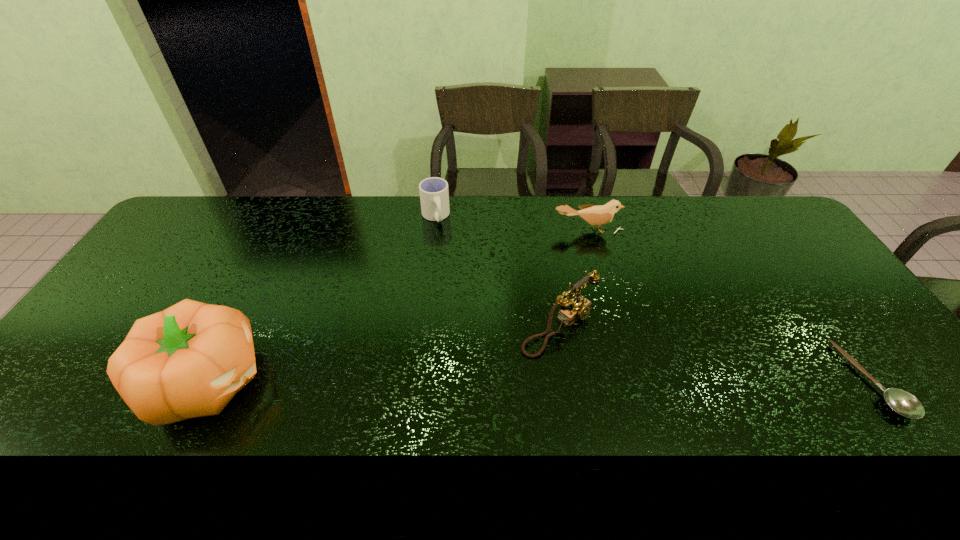
Image resolution: width=960 pixels, height=540 pixels. What are the coordinates of `blank area located with the handle on the side of the fourth object from right to left` in the screenshot? It's located at click(456, 308).

Find the location of a particular element. free space located with the handle on the side of the fourth object from right to left is located at coordinates click(x=450, y=284).

This screenshot has height=540, width=960. I want to click on vacant area situated on the front-facing side of the telephone, so click(x=613, y=367).

Identify the location of vacant space located on the front-facing side of the telephone. (655, 398).

Identify the location of free location located 0.090m on the front-facing side of the telephone. (620, 372).

This screenshot has height=540, width=960. I want to click on free location located 0.080m at the beak of the bird, so click(x=592, y=252).

Locate an element on the screen. The height and width of the screenshot is (540, 960). vacant area situated 0.080m at the beak of the bird is located at coordinates (592, 252).

The image size is (960, 540). In order to click on blank area located 0.390m at the beak of the bird in this screenshot , I will do `click(610, 327)`.

Locate an element on the screen. cup at the far edge is located at coordinates [434, 196].

Where is `bird positioned at the far edge`? This screenshot has width=960, height=540. bird positioned at the far edge is located at coordinates (600, 215).